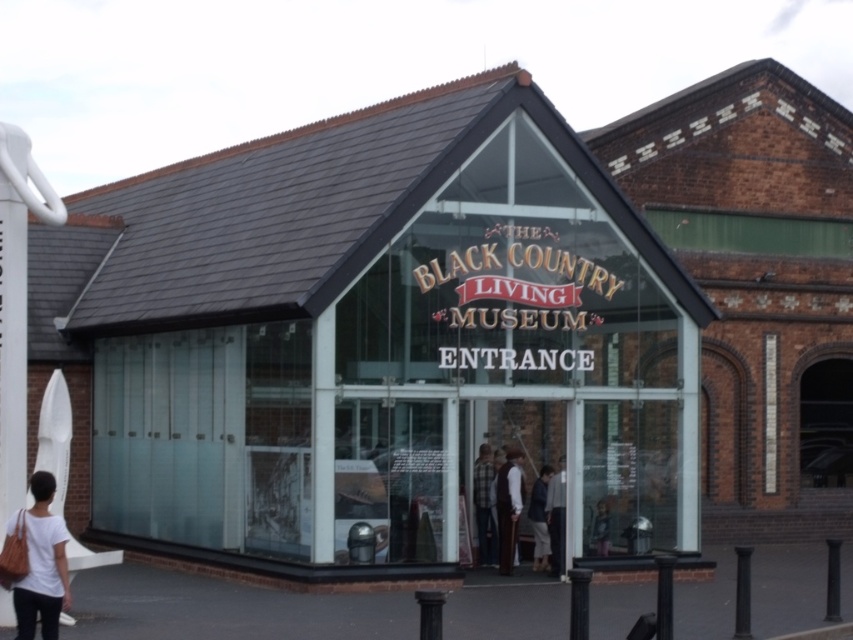
Question: Is black asphalt pavement at lower center below dark brown leather jacket at center?

Choices:
 (A) no
 (B) yes

Answer: (B)

Question: Is transparent glass building at center positioned behind dark brown leather jacket at center?

Choices:
 (A) no
 (B) yes

Answer: (A)

Question: Which of the following is the closest to the observer?

Choices:
 (A) (42, 513)
 (B) (642, 428)
 (C) (554, 545)

Answer: (A)

Question: Which point appears farthest from the camera in this image?

Choices:
 (A) (364, 612)
 (B) (306, 161)
 (C) (538, 493)
 (D) (38, 529)

Answer: (B)

Question: Among these points, which one is nearest to the camera?

Choices:
 (A) (558, 465)
 (B) (538, 557)
 (C) (274, 374)
 (D) (596, 621)

Answer: (D)

Question: Is light brown leather jacket at center above dark brown leather jacket at center?

Choices:
 (A) no
 (B) yes

Answer: (A)